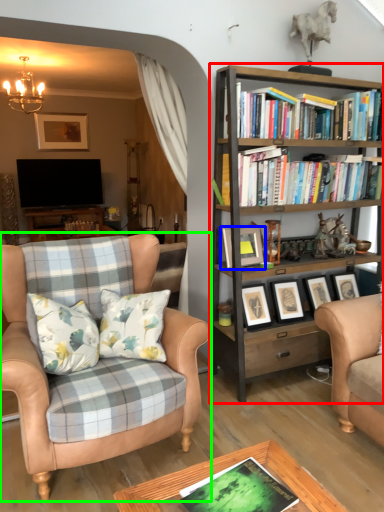
Question: Considering the real-world distances, which object is closest to bookcase (highlighted by a red box)? picture frame (highlighted by a blue box) or chair (highlighted by a green box).

Choices:
 (A) picture frame
 (B) chair

Answer: (A)